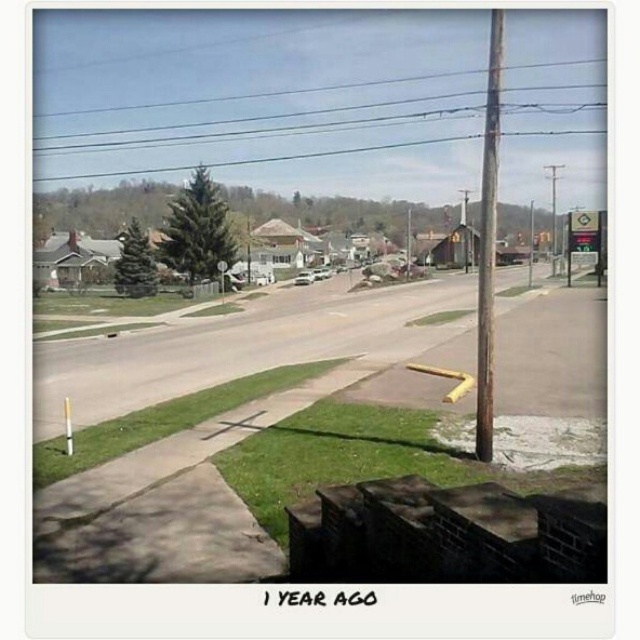
You are standing on the sidewalk in the suburban street scene and want to walk to the steps leading to the building. There are two points marked on the path ahead of you at coordinates point (x=483, y=195) and point (x=604, y=248). Which point should you reach first while walking towards the steps?

You should reach point (x=483, y=195) first because it is in front of point (x=604, y=248) along your path towards the steps.